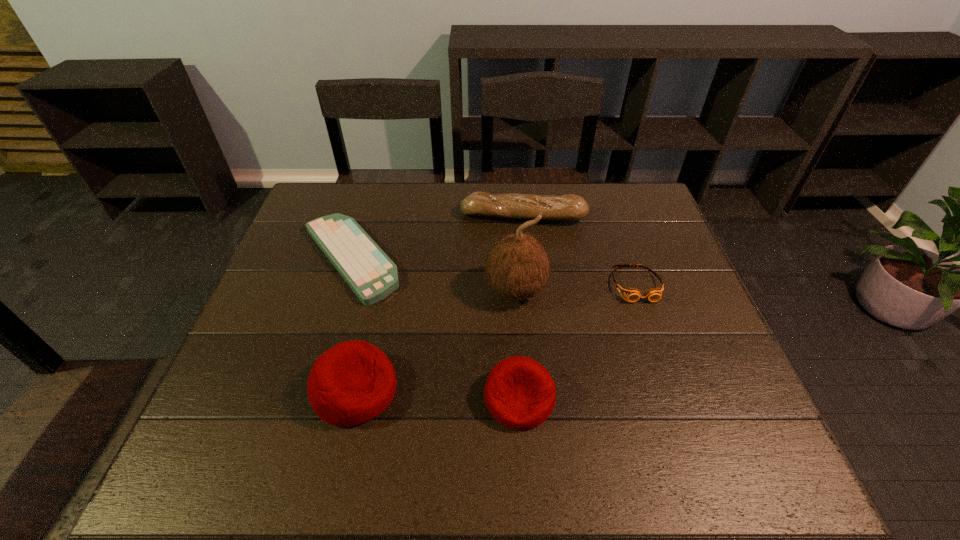
Please point out where to position a new beanbag on the right to maintain spacing. Please provide its 2D coordinates. Your answer should be formatted as a tuple, i.e. [(x, y)], where the tuple contains the x and y coordinates of a point satisfying the conditions above.

[(688, 407)]